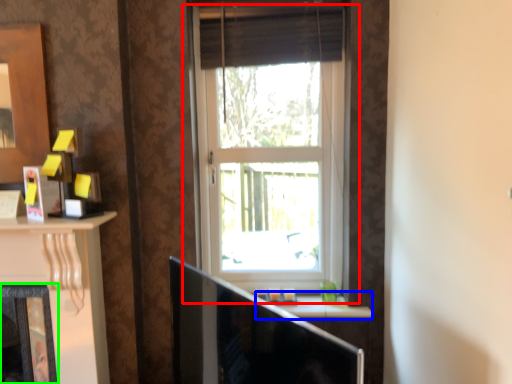
Question: Considering the real-world distances, which object is closest to window (highlighted by a red box)? window sill (highlighted by a blue box) or fireplace (highlighted by a green box).

Choices:
 (A) window sill
 (B) fireplace

Answer: (A)